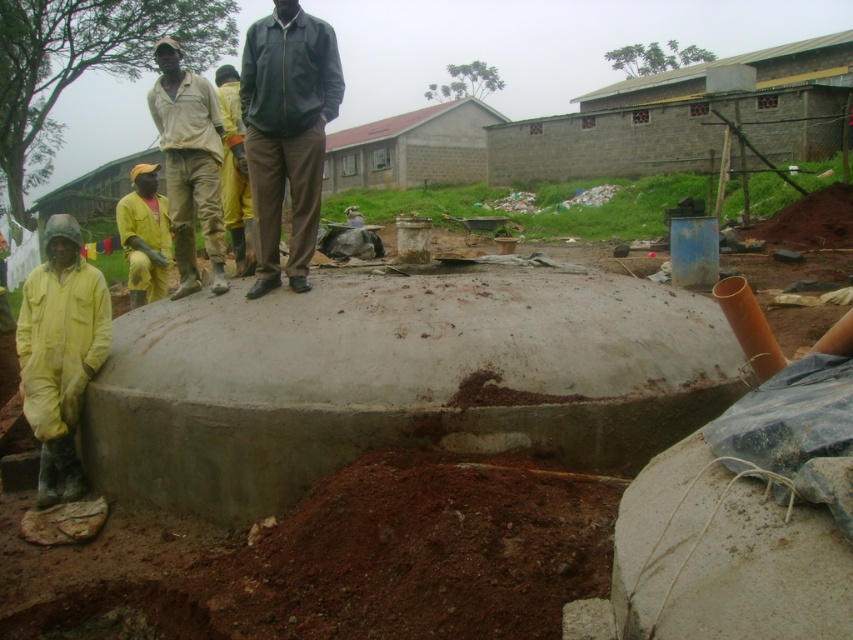
Is dark green jacket at center positioned in front of light beige fabric shirt at center?

Yes, dark green jacket at center is closer to the viewer.

Is dark green jacket at center smaller than light beige fabric shirt at center?

Indeed, dark green jacket at center has a smaller size compared to light beige fabric shirt at center.

Does point (265, 250) come in front of point (199, 104)?

That is True.

Locate an element on the screen. Image resolution: width=853 pixels, height=640 pixels. dark green jacket at center is located at coordinates (287, 132).

What do you see at coordinates (61, 353) in the screenshot? I see `yellow rubber suit at lower left` at bounding box center [61, 353].

Who is taller, yellow rubber suit at lower left or light beige fabric shirt at center?

With more height is light beige fabric shirt at center.

Looking at this image, measure the distance between point (x=93, y=369) and camera.

Point (x=93, y=369) is 4.86 meters away from camera.

Identify the location of yellow rubber suit at lower left. This screenshot has height=640, width=853. (61, 353).

Is yellow rubber suit at lower left to the left of yellow rubber boots at center from the viewer's perspective?

Correct, you'll find yellow rubber suit at lower left to the left of yellow rubber boots at center.

Is yellow rubber suit at lower left closer to camera compared to yellow rubber boots at center?

Yes, it is in front of yellow rubber boots at center.

Where is `yellow rubber suit at lower left`? The image size is (853, 640). yellow rubber suit at lower left is located at coordinates (61, 353).